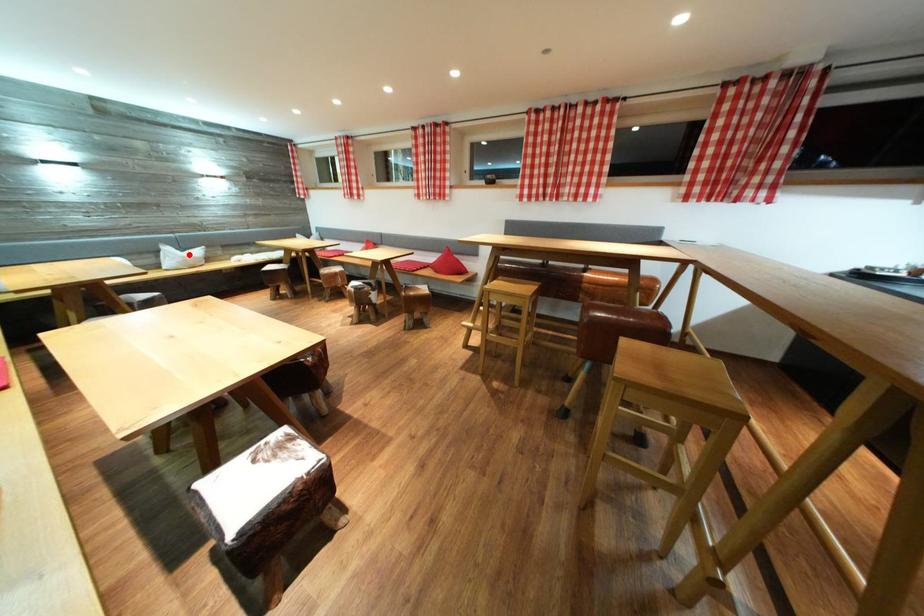
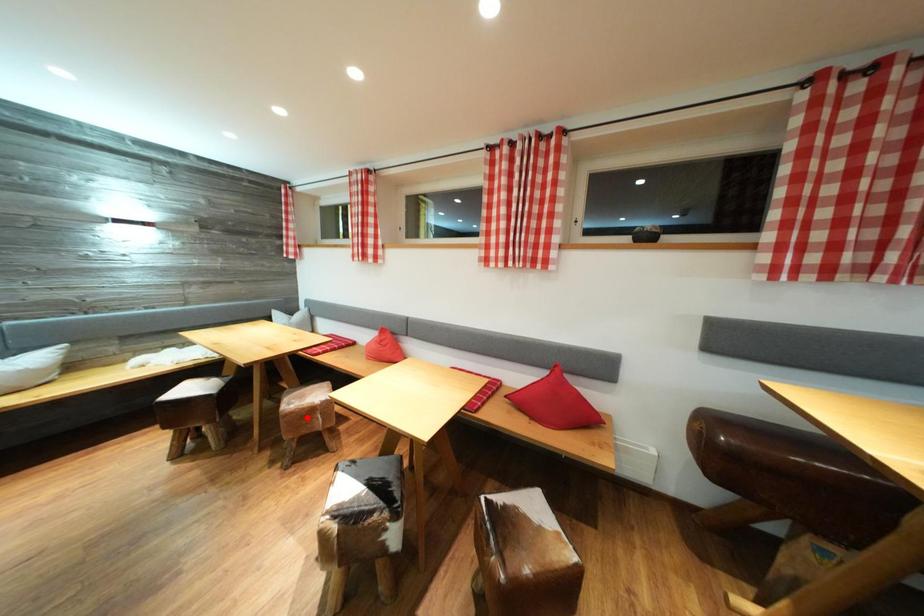
I am providing you with two images of the same scene from different viewpoints. A red point is marked on the first image and another point is marked on the second image. Is the marked point in image1 the same physical position as the marked point in image2?

No